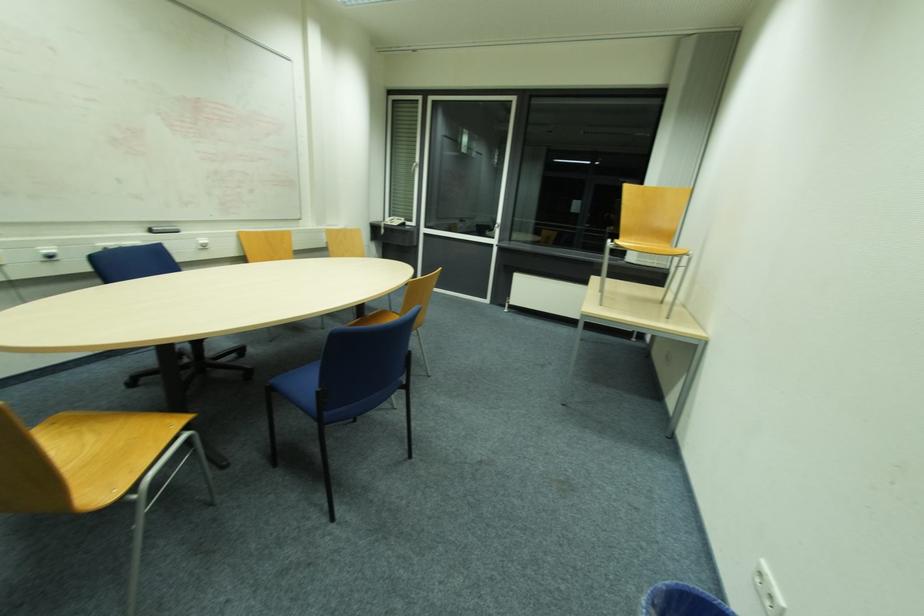
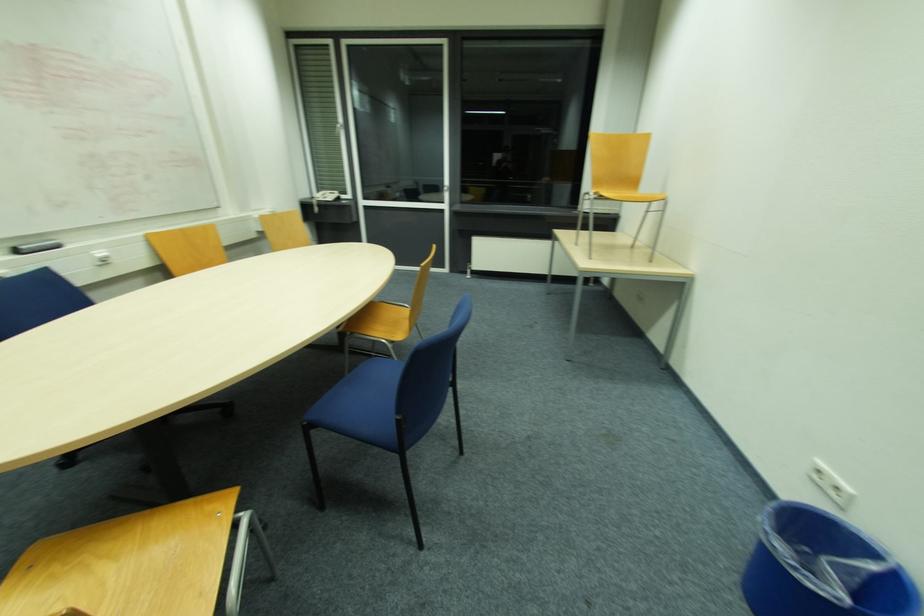
In a continuous first-person perspective shot, in which direction is the camera moving?

The movement direction of the cameraman is left, forward.